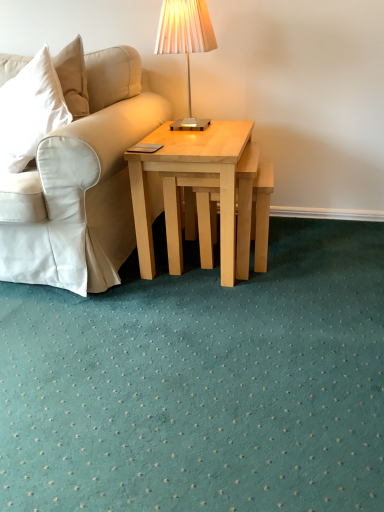
Find the location of `free point in front of natural wood coffee table at center`. free point in front of natural wood coffee table at center is located at coordinates (214, 312).